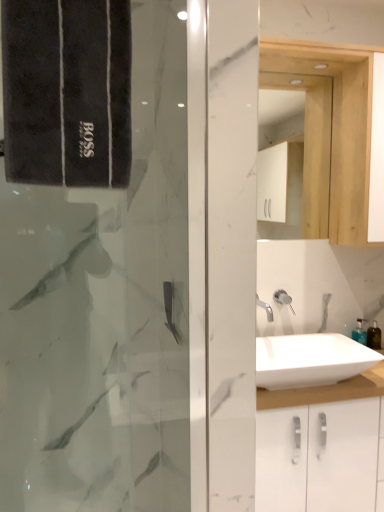
Question: Considering the positions of white wood medicine cabinet at upper right and white glossy shower at center in the image, is white wood medicine cabinet at upper right bigger or smaller than white glossy shower at center?

Choices:
 (A) big
 (B) small

Answer: (A)

Question: In the image, is white wood medicine cabinet at upper right positioned in front of or behind white glossy shower at center?

Choices:
 (A) front
 (B) behind

Answer: (A)

Question: Estimate the real-world distances between objects in this image. Which object is farther from the white glossy sink at center?

Choices:
 (A) white glossy shower at center
 (B) white wood medicine cabinet at upper right
 (C) translucent plastic soap dispenser at lower right
 (D) black velvet towel at left

Answer: (D)

Question: Which object is positioned closest to the white wood medicine cabinet at upper right?

Choices:
 (A) translucent plastic soap dispenser at lower right
 (B) black velvet towel at left
 (C) white glossy sink at center
 (D) white glossy shower at center

Answer: (D)